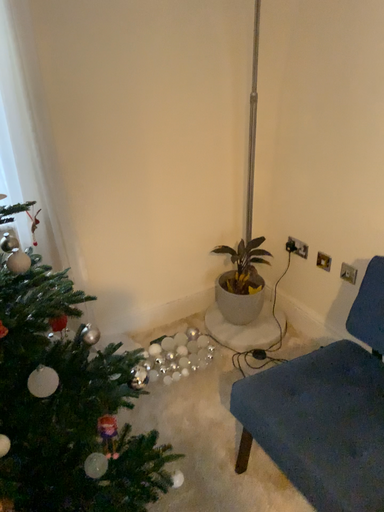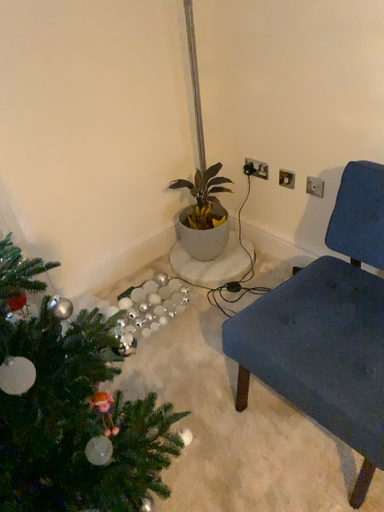
Question: How did the camera likely rotate when shooting the video?

Choices:
 (A) rotated right
 (B) rotated left

Answer: (A)